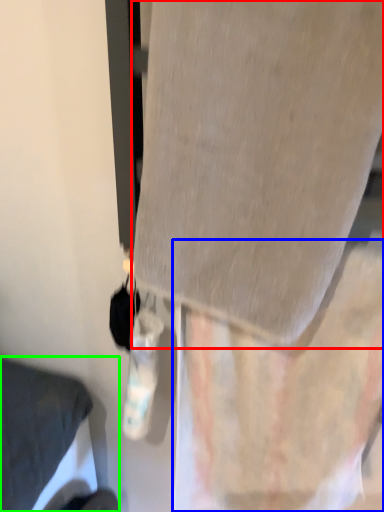
Question: Considering the real-world distances, which object is closest to fabric (highlighted by a red box)? curtain (highlighted by a blue box) or furniture (highlighted by a green box).

Choices:
 (A) curtain
 (B) furniture

Answer: (A)